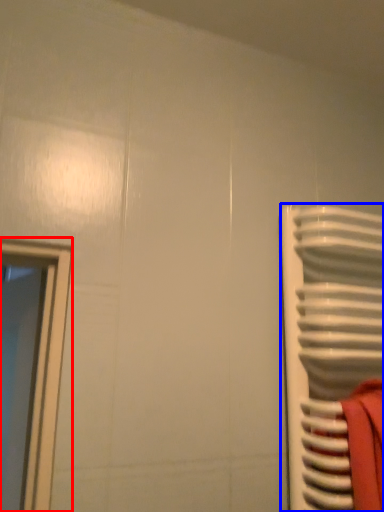
Question: Which of the following is the closest to the observer, window (highlighted by a red box) or radiator (highlighted by a blue box)?

Choices:
 (A) window
 (B) radiator

Answer: (B)